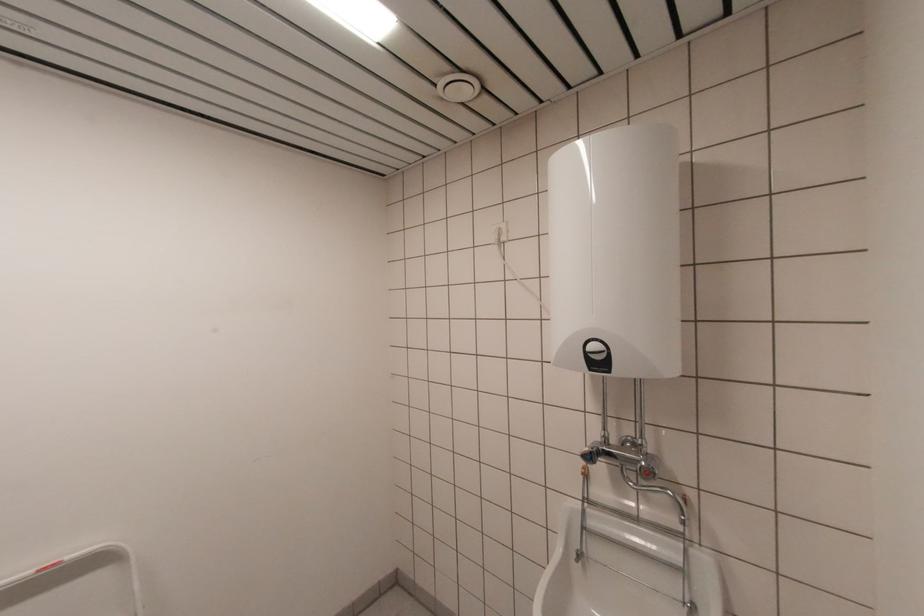
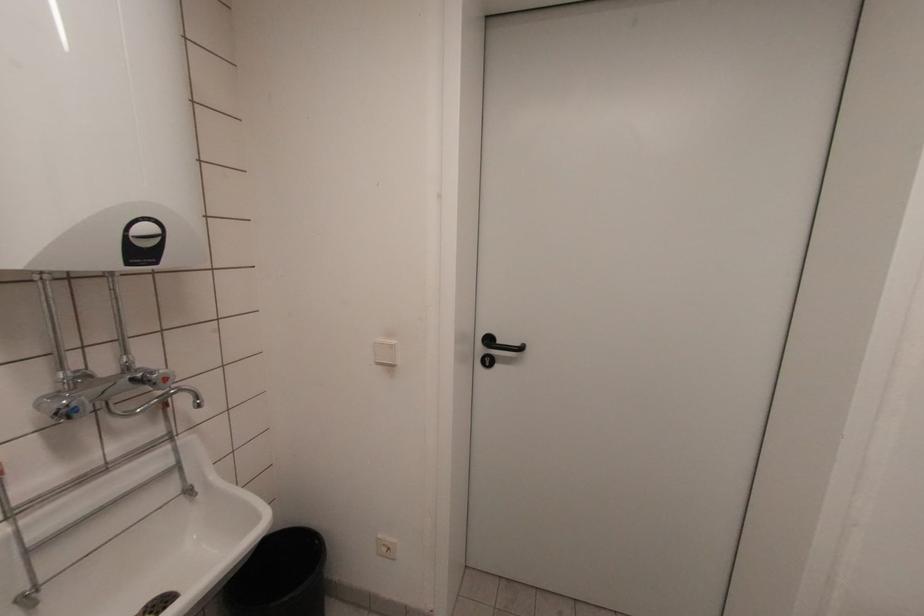
The point at (604, 370) is marked in the first image. Where is the corresponding point in the second image?

(151, 261)